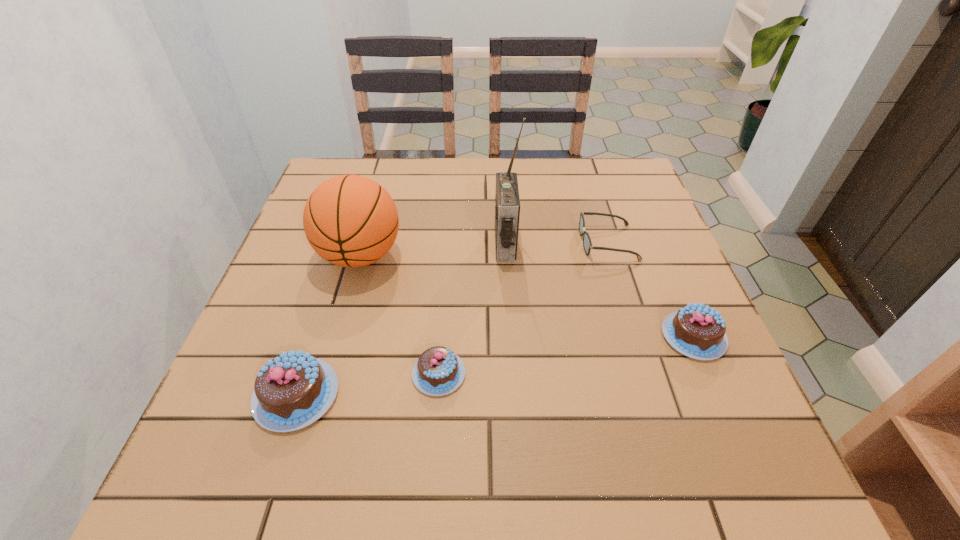
If equal spacing is the goal by inserting an additional chocolate_cake among them, please point out a vacant space for this new chocolate_cake. Please provide its 2D coordinates. Your answer should be formatted as a tuple, i.e. [(x, y)], where the tuple contains the x and y coordinates of a point satisfying the conditions above.

[(571, 354)]